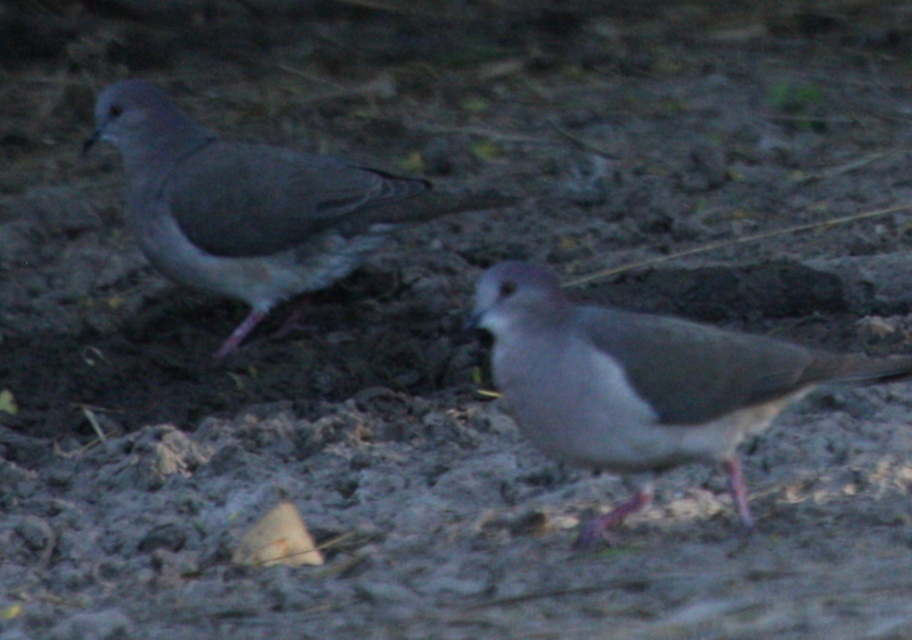
You are a birdwatcher trying to identify birds in the image. There is a point marked at coordinates (641,381). What bird is located at this point?

The point at (641,381) marks the gray matte dove at center.

You are a photographer trying to capture both birds in a single shot. Given their positions, can you determine if the gray matte dove at center will be in the frame if you focus on the other bird?

The gray matte dove at center is located at point (641,381), so if you focus on the other bird, the gray matte dove at center will still be in the frame as long as the camera angle includes that coordinate.

You are a small animal trying to cross between the gray matte dove at center and the gray matte dove at left. The path between them is narrow. If you need at least 1 meter of space to safely pass through, can you fit through the gap?

The gray matte dove at center and gray matte dove at left are 1.23 meters apart from each other, which is more than the required 1 meter. Therefore, you can safely pass through the gap between them.